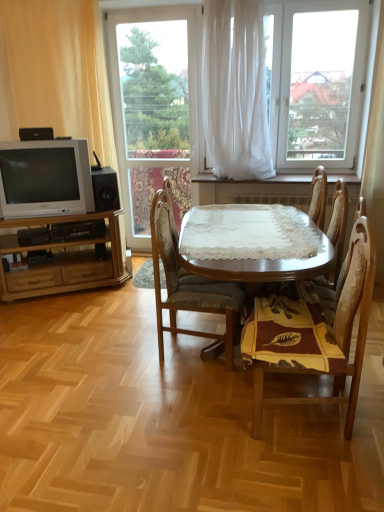
I want to click on vacant space situated on the left part of wooden chair at center, the second chair positioned from the right, so pos(189,428).